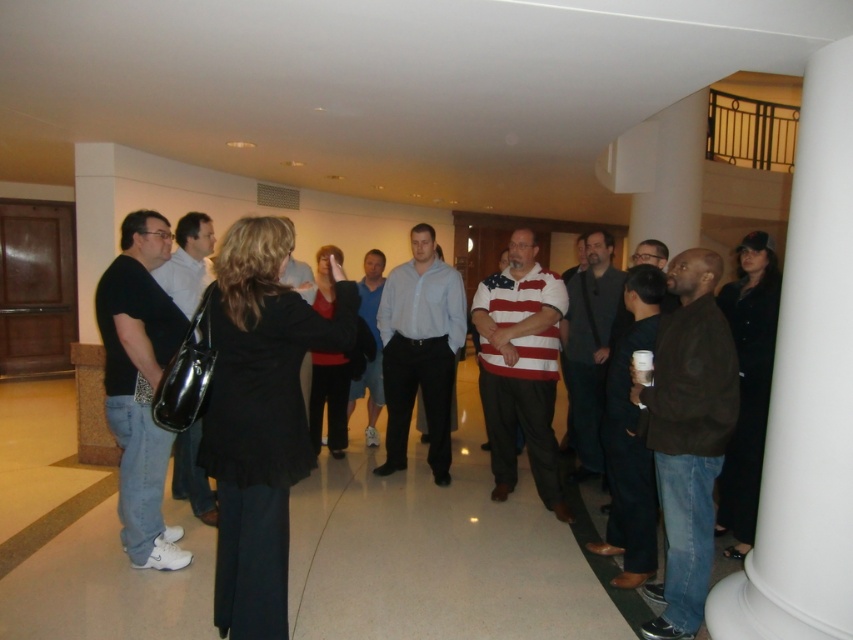
Is black matte shirt at left further to camera compared to striped cotton shirt at center?

No, black matte shirt at left is in front of striped cotton shirt at center.

What do you see at coordinates (140, 385) in the screenshot? I see `black matte shirt at left` at bounding box center [140, 385].

Which is in front, point (140, 560) or point (494, 301)?

Point (140, 560)

The image size is (853, 640). What are the coordinates of `black matte shirt at left` in the screenshot? It's located at (140, 385).

Between point (671, 444) and point (392, 387), which one is positioned behind?

Point (392, 387)

Can you confirm if brown suede jacket at lower right is positioned below matte white shirt at center?

Yes, brown suede jacket at lower right is below matte white shirt at center.

Find the location of a particular element. brown suede jacket at lower right is located at coordinates 688,435.

I want to click on brown suede jacket at lower right, so click(688, 435).

Is black matte blazer at center positioned in front of black matte shirt at left?

Yes.

Who is higher up, black matte blazer at center or black matte shirt at left?

black matte shirt at left is higher up.

Who is more forward, (254,339) or (136,333)?

Positioned in front is point (254,339).

Find the location of a particular element. The width and height of the screenshot is (853, 640). black matte blazer at center is located at coordinates (260, 417).